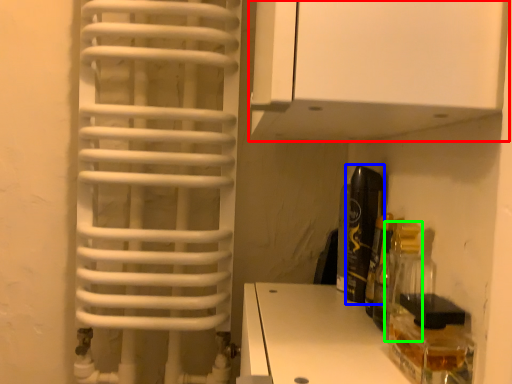
Question: Based on their relative distances, which object is farther from cabinetry (highlighted by a red box)? Choose from bottle (highlighted by a blue box) and bottle (highlighted by a green box).

Choices:
 (A) bottle
 (B) bottle

Answer: (B)